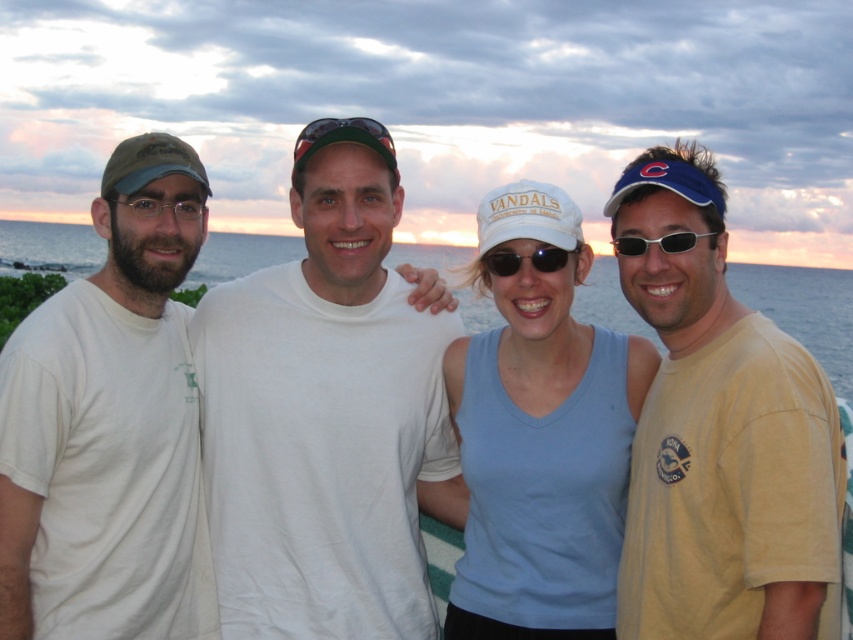
Can you confirm if black plastic sunglasses at right is positioned to the right of sunglasses at center?

Correct, you'll find black plastic sunglasses at right to the right of sunglasses at center.

Does point (630, 246) lie in front of point (306, 134)?

That is True.

Is point (627, 253) farther from camera compared to point (300, 132)?

No, (627, 253) is closer to viewer.

Locate an element on the screen. The width and height of the screenshot is (853, 640). black plastic sunglasses at right is located at coordinates (659, 243).

Which is behind, point (541, 253) or point (630, 244)?

The point (541, 253) is more distant.

Which is above, black reflective sunglasses at center or black plastic sunglasses at right?

Positioned higher is black plastic sunglasses at right.

Is point (492, 266) more distant than point (671, 248)?

Yes, point (492, 266) is behind point (671, 248).

The image size is (853, 640). In order to click on black reflective sunglasses at center in this screenshot , I will do `click(527, 257)`.

Does white matte baseball cap at center have a larger size compared to black plastic sunglasses at right?

Yes.

Locate an element on the screen. The width and height of the screenshot is (853, 640). white matte baseball cap at center is located at coordinates (527, 216).